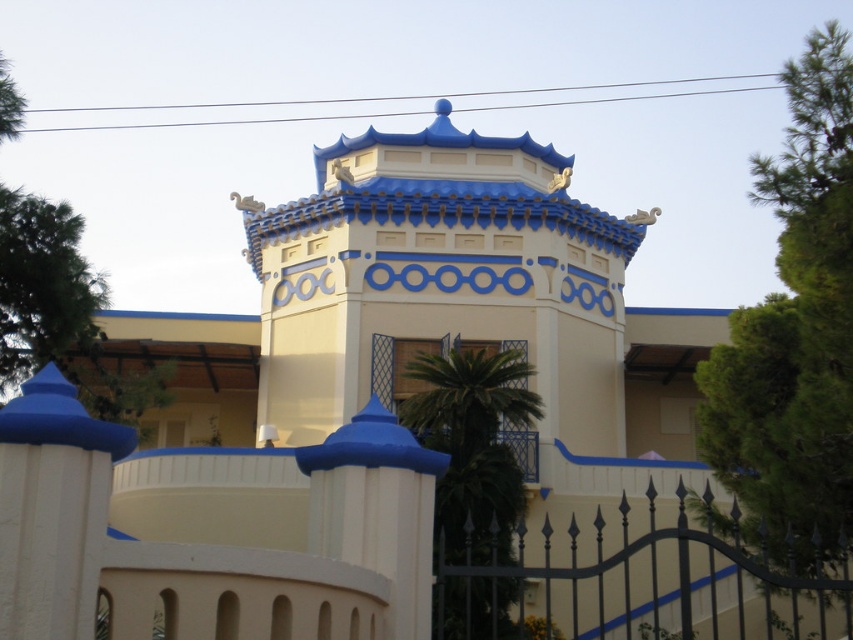
Question: Is black wrought iron fence at lower right positioned behind green leafy palm tree at center?

Choices:
 (A) yes
 (B) no

Answer: (B)

Question: Among these points, which one is farthest from the camera?

Choices:
 (A) (515, 467)
 (B) (442, 630)

Answer: (A)

Question: Among these objects, which one is nearest to the camera?

Choices:
 (A) green leafy palm tree at center
 (B) black wrought iron fence at lower right

Answer: (B)

Question: Does black wrought iron fence at lower right lie behind green leafy palm tree at center?

Choices:
 (A) yes
 (B) no

Answer: (B)

Question: Does black wrought iron fence at lower right appear on the left side of green leafy palm tree at center?

Choices:
 (A) no
 (B) yes

Answer: (A)